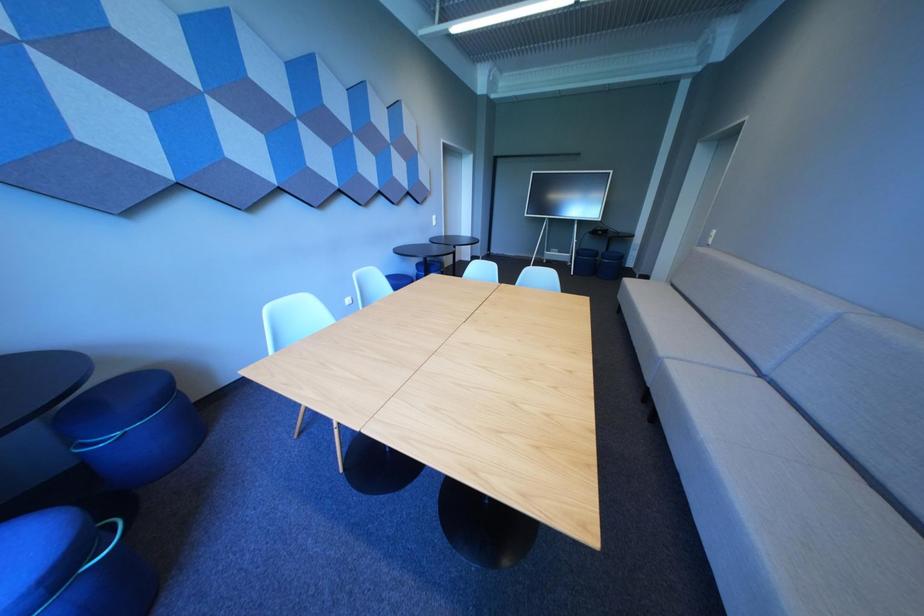
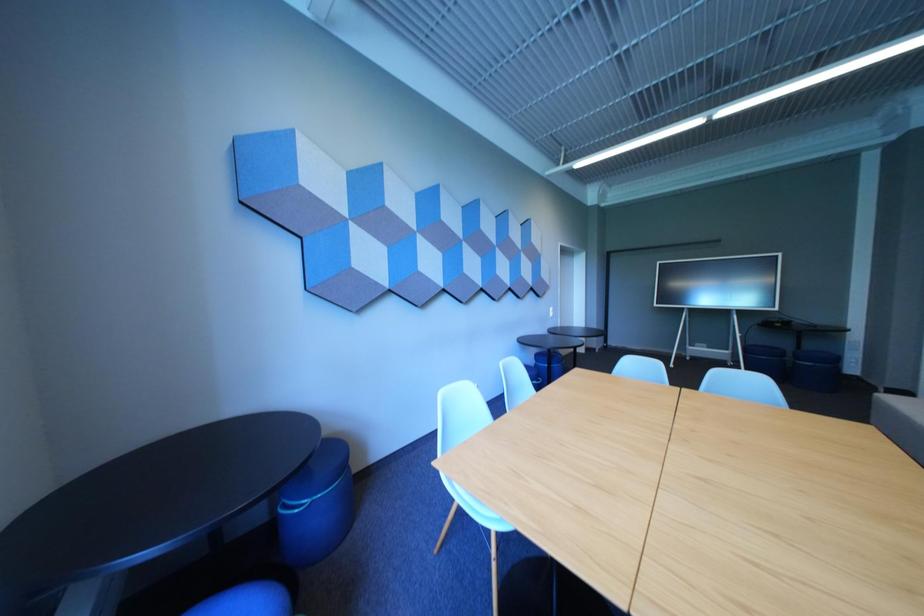
Question: In a continuous first-person perspective shot, in which direction is the camera moving?

Choices:
 (A) Left
 (B) Right
 (C) Forward
 (D) Backward

Answer: (A)